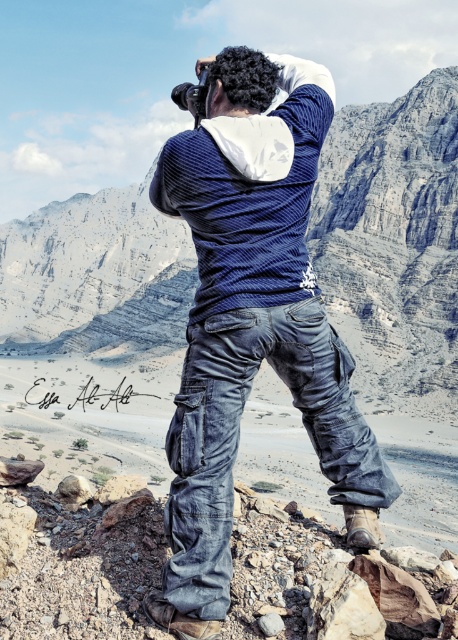
Which is behind, point (356, 541) or point (413, 305)?

The point (413, 305) is more distant.

Is point (207, 362) farther from camera compared to point (33, 324)?

That is False.

The height and width of the screenshot is (640, 458). In order to click on denim pants at center in this screenshot , I will do `click(252, 321)`.